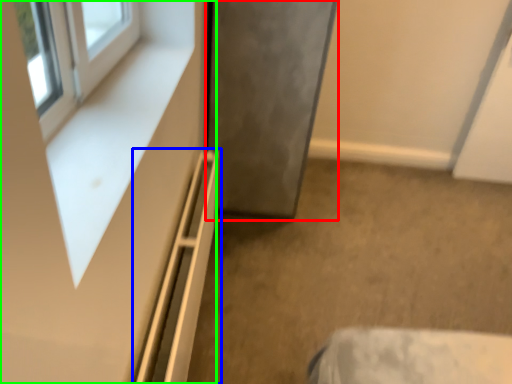
Question: Which is farther away from door (highlighted by a red box)? shelf (highlighted by a blue box) or dresser (highlighted by a green box)?

Choices:
 (A) shelf
 (B) dresser

Answer: (B)